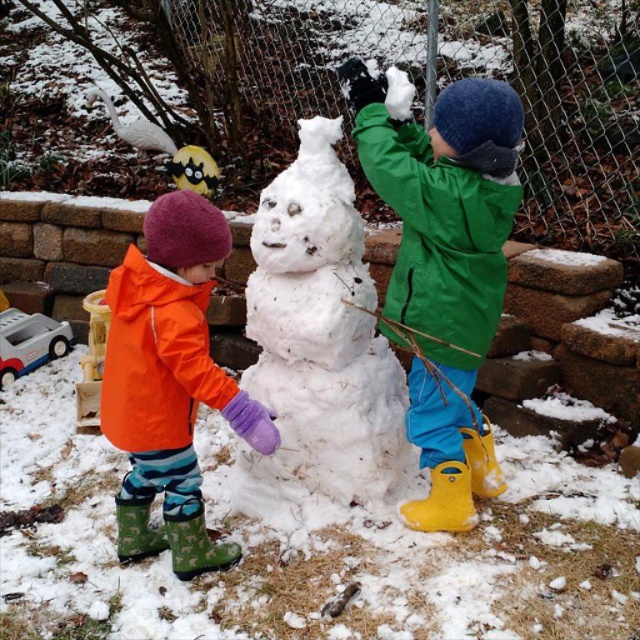
Question: Can you confirm if white fluffy snowman at center is wider than orange waterproof jacket at center?

Choices:
 (A) no
 (B) yes

Answer: (B)

Question: Is white fluffy snowman at center thinner than orange waterproof jacket at center?

Choices:
 (A) no
 (B) yes

Answer: (A)

Question: Which point is closer to the camera?

Choices:
 (A) (150, 305)
 (B) (356, 268)

Answer: (A)

Question: Which of the following is the closest to the observer?

Choices:
 (A) orange waterproof jacket at center
 (B) white fluffy snowman at center

Answer: (A)

Question: Does white fluffy snowman at center appear on the right side of orange waterproof jacket at center?

Choices:
 (A) no
 (B) yes

Answer: (B)